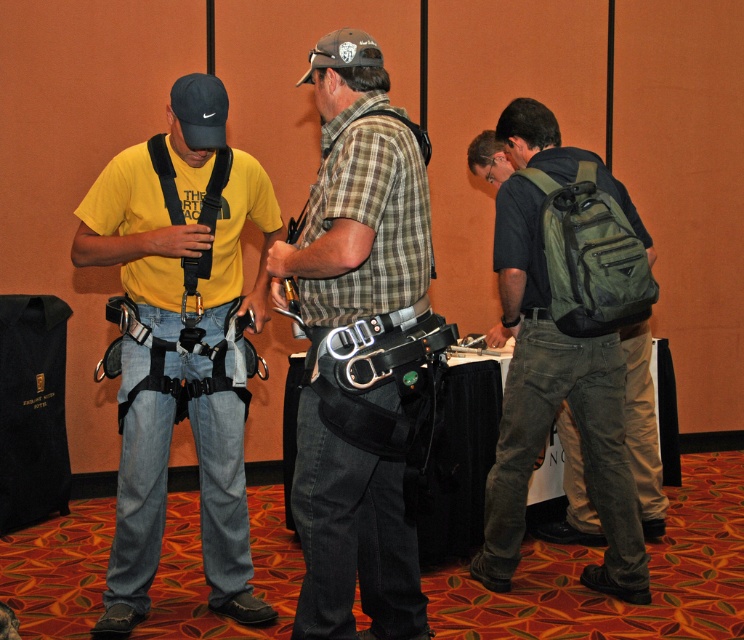
Which is more to the right, matte black harness at center or green canvas backpack at right?

From the viewer's perspective, green canvas backpack at right appears more on the right side.

In the scene shown: Is matte black harness at center smaller than green canvas backpack at right?

Actually, matte black harness at center might be larger than green canvas backpack at right.

Between point (224, 260) and point (635, 524), which one is positioned in front?

Point (224, 260)

I want to click on matte black harness at center, so click(x=182, y=339).

Is plaid fabric shirt at center to the right of green canvas backpack at right from the viewer's perspective?

In fact, plaid fabric shirt at center is to the left of green canvas backpack at right.

Does point (381, 333) come behind point (496, 506)?

No, it is not.

Which is behind, point (400, 236) or point (597, 358)?

The point (597, 358) is behind.

Where is `plaid fabric shirt at center`? This screenshot has height=640, width=744. plaid fabric shirt at center is located at coordinates (336, 360).

Can you confirm if matte black harness at center is positioned to the left of plaid fabric shirt at center?

Indeed, matte black harness at center is positioned on the left side of plaid fabric shirt at center.

Is matte black harness at center thinner than plaid fabric shirt at center?

In fact, matte black harness at center might be wider than plaid fabric shirt at center.

Identify the location of matte black harness at center. (182, 339).